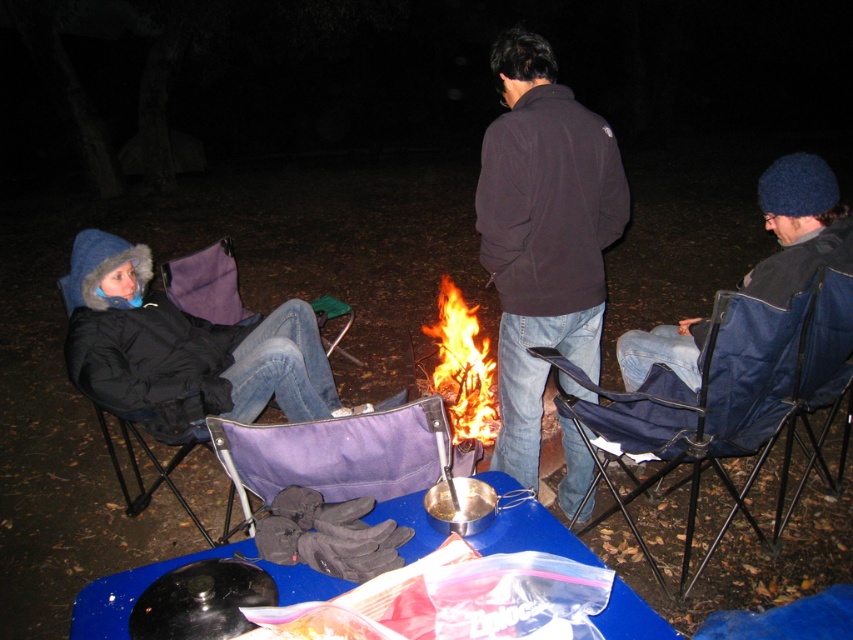
Question: Among these objects, which one is nearest to the camera?

Choices:
 (A) flamewoodenbonfire at center
 (B) blue fabric chair at center
 (C) purple fabric chair at left

Answer: (B)

Question: Where is black fuzzy hat at left located in relation to blue fabric chair at center in the image?

Choices:
 (A) above
 (B) below

Answer: (A)

Question: Does black fuzzy hat at left appear under flamewoodenbonfire at center?

Choices:
 (A) no
 (B) yes

Answer: (A)

Question: Among these objects, which one is nearest to the camera?

Choices:
 (A) black fuzzy hat at left
 (B) black padded chair at left

Answer: (B)

Question: Is dark fleece jacket at center to the left of purple canvas chair at center from the viewer's perspective?

Choices:
 (A) yes
 (B) no

Answer: (B)

Question: Which point is farther from the camera taking this photo?

Choices:
 (A) (225, 257)
 (B) (509, 259)
 (C) (212, 540)

Answer: (A)